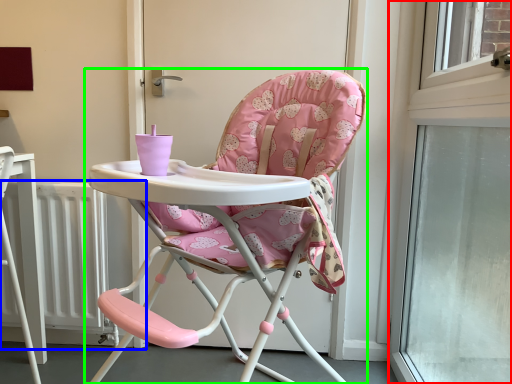
Question: Which object is the closest to the window (highlighted by a red box)? Choose among these: radiator (highlighted by a blue box) or chair (highlighted by a green box).

Choices:
 (A) radiator
 (B) chair

Answer: (B)